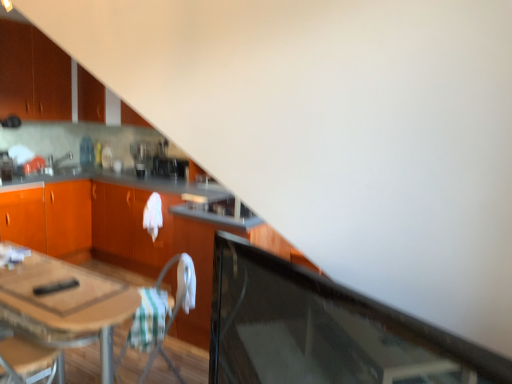
Question: Is matte orange cabinet at upper left, acting as the second cabinetry starting from the top, taller or shorter than matte silver sink at upper left?

Choices:
 (A) tall
 (B) short

Answer: (A)

Question: Choose the correct answer: Is matte orange cabinet at upper left, which is the second cabinetry from bottom to top, inside matte silver sink at upper left or outside it?

Choices:
 (A) outside
 (B) inside

Answer: (A)

Question: Which is farther from the matte orange cabinet at upper left, the 3th cabinetry from the bottom?

Choices:
 (A) transparent glass door at lower right
 (B) white fabric folding chair at center
 (C) orange wood cabinetry at center, the 3th cabinetry positioned from the top
 (D) satin black coffee maker at center, which is the second appliance from left to right
 (E) matte orange cabinet at upper left, acting as the second cabinetry starting from the top

Answer: (A)

Question: Which is nearer to the matte orange cabinet at upper left, marked as the 1th cabinetry in a top-to-bottom arrangement?

Choices:
 (A) satin black coffee maker at center, the second appliance when ordered from front to back
 (B) transparent glass door at lower right
 (C) wooden table at lower left
 (D) matte orange cabinet at upper left, which is the second cabinetry from bottom to top
 (E) metallic silver toaster at left, the second appliance in the back-to-front sequence

Answer: (D)